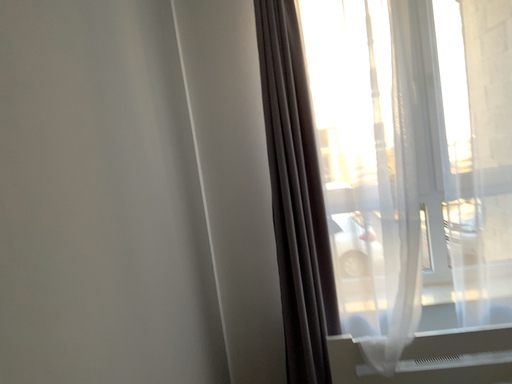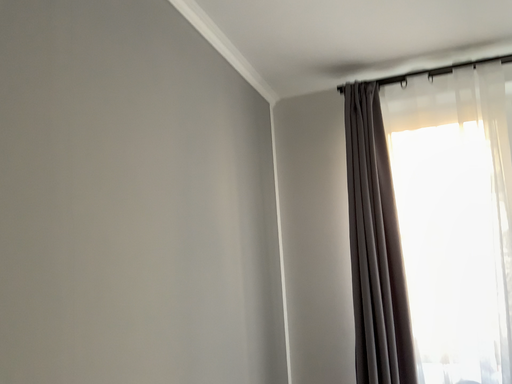
Question: Which way did the camera rotate in the video?

Choices:
 (A) rotated left
 (B) rotated right

Answer: (A)